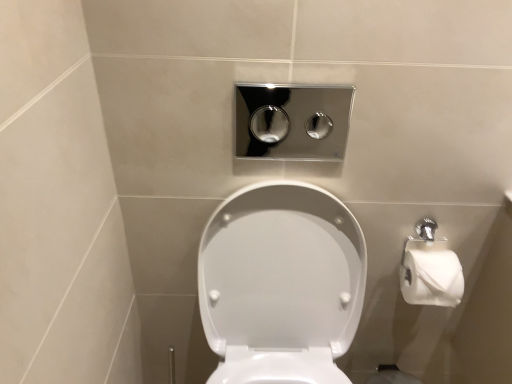
What is the approximate height of white glossy toilet at center?

The height of white glossy toilet at center is 28.74 inches.

At what (x,y) coordinates should I click in order to perform the action: click on white glossy toilet at center. Please return your answer as a coordinate pair (x, y). Image resolution: width=512 pixels, height=384 pixels. Looking at the image, I should click on (281, 284).

The image size is (512, 384). Describe the element at coordinates (281, 284) in the screenshot. I see `white glossy toilet at center` at that location.

The image size is (512, 384). What do you see at coordinates (292, 121) in the screenshot?
I see `polished chrome flush buttons at upper center` at bounding box center [292, 121].

Locate an element on the screen. The width and height of the screenshot is (512, 384). polished chrome flush buttons at upper center is located at coordinates (292, 121).

Locate an element on the screen. This screenshot has height=384, width=512. white glossy toilet at center is located at coordinates (281, 284).

Based on the photo, between white glossy toilet at center and polished chrome flush buttons at upper center, which one appears on the right side from the viewer's perspective?

Positioned to the right is polished chrome flush buttons at upper center.

From the picture: Does white glossy toilet at center lie behind polished chrome flush buttons at upper center?

No, the depth of white glossy toilet at center is less than that of polished chrome flush buttons at upper center.

Considering the points (294, 320) and (283, 126), which point is behind, point (294, 320) or point (283, 126)?

The point (283, 126) is more distant.

From the image's perspective, which one is positioned higher, white glossy toilet at center or polished chrome flush buttons at upper center?

From the image's view, polished chrome flush buttons at upper center is above.

From a real-world perspective, is white glossy toilet at center over polished chrome flush buttons at upper center?

No, from a real-world perspective, white glossy toilet at center is not above polished chrome flush buttons at upper center.

Is white glossy toilet at center wider than polished chrome flush buttons at upper center?

Yes.

Considering the sizes of white glossy toilet at center and polished chrome flush buttons at upper center in the image, is white glossy toilet at center taller or shorter than polished chrome flush buttons at upper center?

Result: In the image, white glossy toilet at center appears to be taller than polished chrome flush buttons at upper center.

Considering the relative sizes of white glossy toilet at center and polished chrome flush buttons at upper center in the image provided, is white glossy toilet at center smaller than polished chrome flush buttons at upper center?

Actually, white glossy toilet at center might be larger than polished chrome flush buttons at upper center.

Is white glossy toilet at center inside the boundaries of polished chrome flush buttons at upper center, or outside?

The correct answer is: outside.

Is white glossy toilet at center directly adjacent to polished chrome flush buttons at upper center?

No, white glossy toilet at center is not with polished chrome flush buttons at upper center.

Is white glossy toilet at center positioned with its back to polished chrome flush buttons at upper center?

white glossy toilet at center is not turned away from polished chrome flush buttons at upper center.

How far apart are white glossy toilet at center and polished chrome flush buttons at upper center?

They are 36.65 inches apart.

The width and height of the screenshot is (512, 384). I want to click on dispenser above the white glossy toilet at center (from a real-world perspective), so click(292, 121).

Can you confirm if polished chrome flush buttons at upper center is positioned to the right of white glossy toilet at center?

Correct, you'll find polished chrome flush buttons at upper center to the right of white glossy toilet at center.

Between polished chrome flush buttons at upper center and white glossy toilet at center, which one is positioned in front?

white glossy toilet at center is in front.

Is point (312, 141) closer to viewer compared to point (275, 366)?

No.

From the image's perspective, is polished chrome flush buttons at upper center below white glossy toilet at center?

Incorrect, from the image's perspective, polished chrome flush buttons at upper center is higher than white glossy toilet at center.

From a real-world perspective, is polished chrome flush buttons at upper center located higher than white glossy toilet at center?

Indeed, from a real-world perspective, polished chrome flush buttons at upper center stands above white glossy toilet at center.

Can you confirm if polished chrome flush buttons at upper center is wider than white glossy toilet at center?

No, polished chrome flush buttons at upper center is not wider than white glossy toilet at center.

Does polished chrome flush buttons at upper center have a lesser height compared to white glossy toilet at center?

Indeed, polished chrome flush buttons at upper center has a lesser height compared to white glossy toilet at center.

Considering the sizes of polished chrome flush buttons at upper center and white glossy toilet at center in the image, is polished chrome flush buttons at upper center bigger or smaller than white glossy toilet at center?

Considering their sizes, polished chrome flush buttons at upper center takes up less space than white glossy toilet at center.

In the scene shown: Would you say polished chrome flush buttons at upper center contains white glossy toilet at center?

No, white glossy toilet at center is not surrounded by polished chrome flush buttons at upper center.

From the picture: Is polished chrome flush buttons at upper center far away from white glossy toilet at center?

Actually, polished chrome flush buttons at upper center and white glossy toilet at center are a little close together.

Is polished chrome flush buttons at upper center facing towards white glossy toilet at center?

No, polished chrome flush buttons at upper center is not oriented towards white glossy toilet at center.

Where is `toilet that is in front of the polished chrome flush buttons at upper center`? This screenshot has height=384, width=512. toilet that is in front of the polished chrome flush buttons at upper center is located at coordinates (281, 284).

In order to click on dispenser lying on the right of white glossy toilet at center in this screenshot , I will do `click(292, 121)`.

The width and height of the screenshot is (512, 384). I want to click on toilet below the polished chrome flush buttons at upper center (from the image's perspective), so click(281, 284).